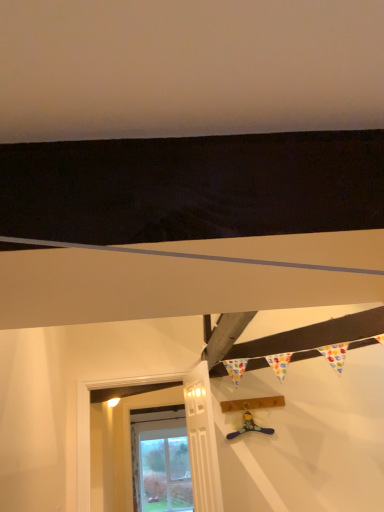
Question: Is white painted wood at lower left taller or shorter than white painted wood door at lower left?

Choices:
 (A) short
 (B) tall

Answer: (B)

Question: Looking at their shapes, would you say white painted wood at lower left is wider or thinner than white painted wood door at lower left?

Choices:
 (A) thin
 (B) wide

Answer: (B)

Question: Estimate the real-world distances between objects in this image. Which object is farther from the white painted wood door at lower left?

Choices:
 (A) white painted wood at lower left
 (B) blue fabric toy at center

Answer: (A)

Question: Which object is positioned farthest from the white painted wood door at lower left?

Choices:
 (A) white painted wood at lower left
 (B) blue fabric toy at center

Answer: (A)